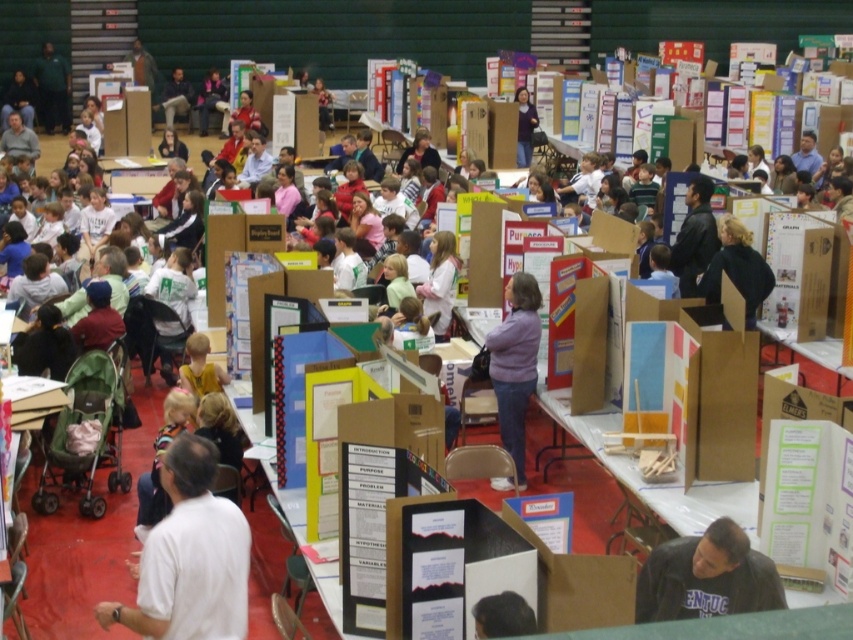
Question: Which of the following is the farthest from the observer?

Choices:
 (A) (759, 589)
 (B) (227, 608)

Answer: (A)

Question: Which object is closer to the camera taking this photo?

Choices:
 (A) blonde hair at center
 (B) purple fabric shirt at center
 (C) dark gray sweatshirt at lower right
 (D) matte purple shirt at center

Answer: (C)

Question: Is white shirt at lower left positioned in front of purple fabric shirt at center?

Choices:
 (A) yes
 (B) no

Answer: (A)

Question: Which object is the closest to the purple fabric shirt at center?

Choices:
 (A) matte purple shirt at center
 (B) blonde hair at center
 (C) dark gray sweatshirt at lower right

Answer: (B)

Question: Is white shirt at lower left behind matte purple shirt at center?

Choices:
 (A) no
 (B) yes

Answer: (A)

Question: Does white shirt at lower left appear on the left side of blonde hair at center?

Choices:
 (A) yes
 (B) no

Answer: (A)